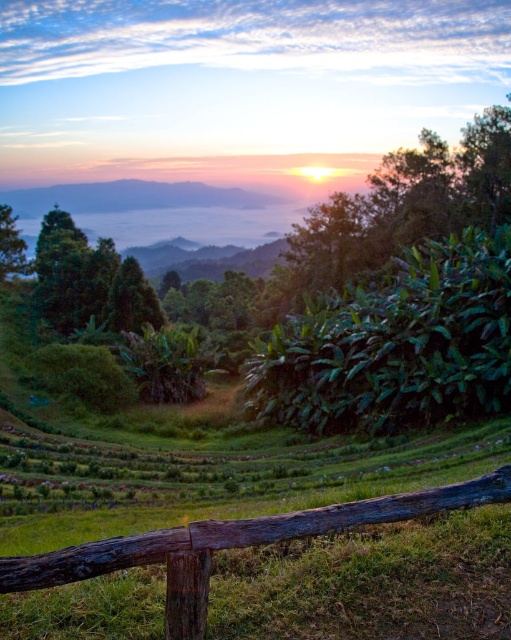
You are standing at the point labeled point at (421, 374). You want to walk to the dense cluster of banana plants in the midground. How far will you have to walk?

The dense cluster of banana plants in the midground is 24.71 meters away from the point at (421, 374), so you will have to walk 24.71 meters.